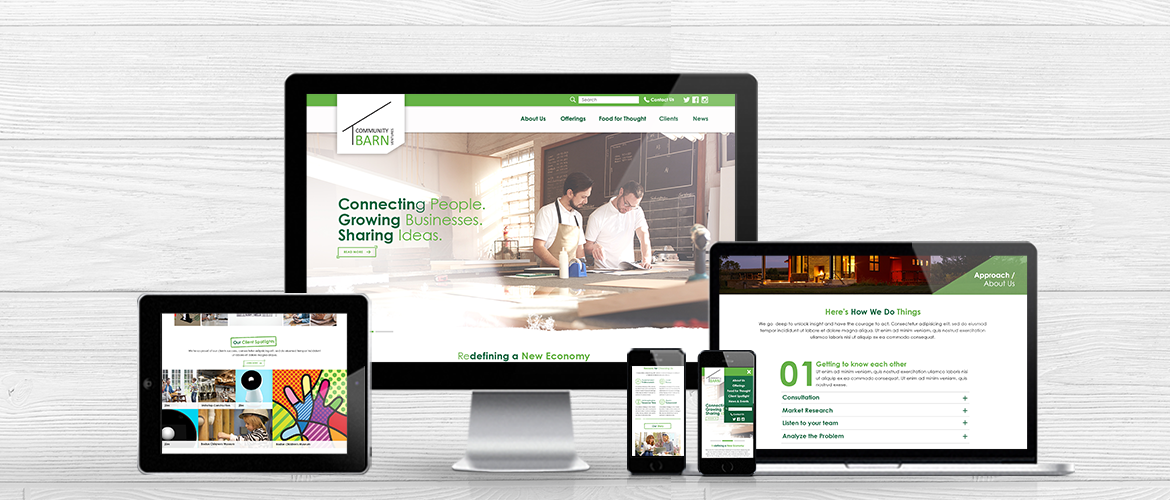
The image size is (1170, 500). What are the coordinates of `phone` in the screenshot? It's located at (644, 354), (738, 356).